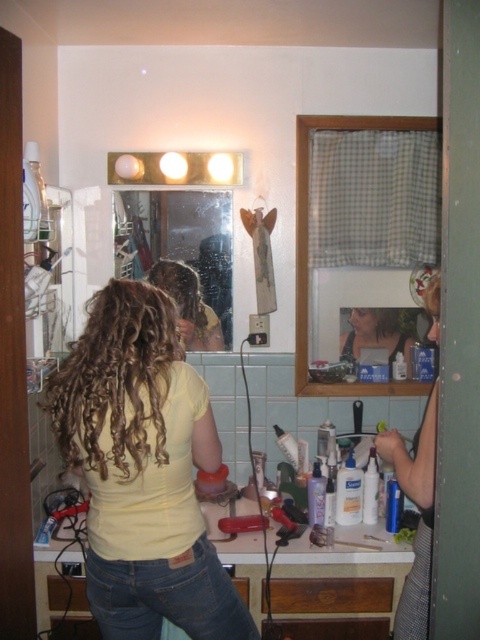
Looking at this image, you are a person trying to reach the matte plastic bottle at upper center while standing in front of the clear glass mirror at center. Can you reach it without moving the mirror?

The clear glass mirror at center is in front of the matte plastic bottle at upper center, so you cannot reach it without moving the mirror.

You are standing in the bathroom and want to see your reflection in the clear glass mirror at center while looking at your curly brown hair at center. Which object should you look toward first?

You should look toward the curly brown hair at center first because the clear glass mirror at center is positioned on the right side of it, so the reflection will show both the hair and the mirror.

You are a bathroom designer trying to place a new shelf. The clear glass mirror at center is located at coordinates 0.402, 0.385. Where should you place the shelf so it doesn

The clear glass mirror at center is located at coordinates (184,257). To place the shelf, ensure it doesn